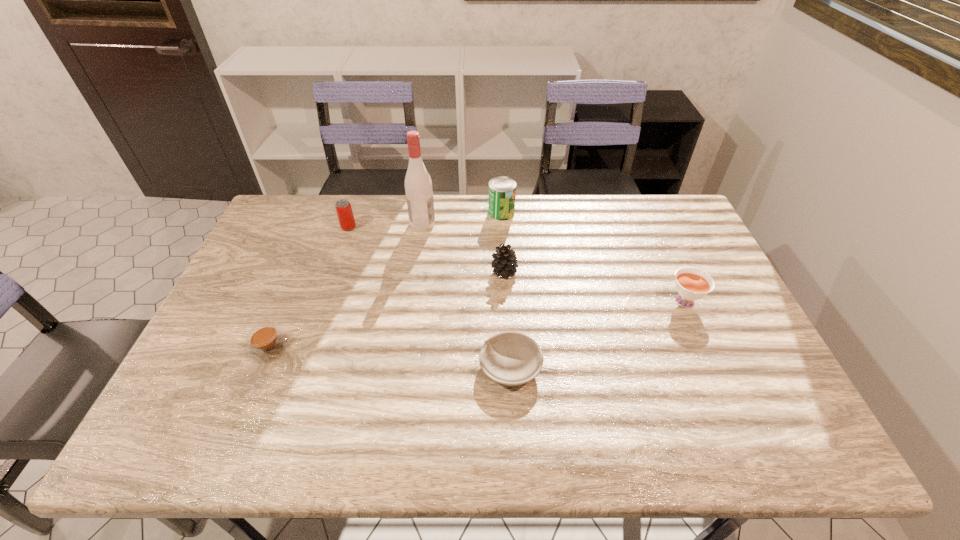
Find the location of a particular element. The width and height of the screenshot is (960, 540). free space between the cappuccino and the third object from left to right is located at coordinates tap(346, 285).

You are a GUI agent. You are given a task and a screenshot of the screen. Output one action in this format:
    pyautogui.click(x=<x>, y=<y>)
    Task: Click on the free point between the can and the shortest object
    Image resolution: width=960 pixels, height=540 pixels.
    Given the screenshot: What is the action you would take?
    pyautogui.click(x=506, y=290)

Identify the location of vacant region between the sixth object from right to left and the pinecone. The width and height of the screenshot is (960, 540). (426, 249).

You are a GUI agent. You are given a task and a screenshot of the screen. Output one action in this format:
    pyautogui.click(x=<x>, y=<y>)
    Task: Click on the empty space that is in between the rightmost object and the shortest object
    This screenshot has height=540, width=960.
    Given the screenshot: What is the action you would take?
    pyautogui.click(x=597, y=333)

Where is `vacant area that lies between the rightmost object and the pinecone`? This screenshot has width=960, height=540. vacant area that lies between the rightmost object and the pinecone is located at coordinates (594, 286).

The width and height of the screenshot is (960, 540). What are the coordinates of `free space between the fifth farthest object and the second shortest object` in the screenshot? It's located at (476, 323).

Find the location of a particular element. The height and width of the screenshot is (540, 960). object that is the closest to the alcohol is located at coordinates (343, 207).

Identify which object is the sixth closest to the leftmost object. Please provide its 2D coordinates. Your answer should be formatted as a tuple, i.e. [(x, y)], where the tuple contains the x and y coordinates of a point satisfying the conditions above.

[(691, 285)]

Find the location of a particular element. vacant point that satisfies the following two spatial constraints: 1. on the label of the tallest object; 2. on the front side of the cappuccino is located at coordinates coord(404,347).

The height and width of the screenshot is (540, 960). What are the coordinates of `free space that satisfies the following two spatial constraints: 1. on the front side of the cappuccino; 2. on the right side of the shortest object` in the screenshot? It's located at (260, 368).